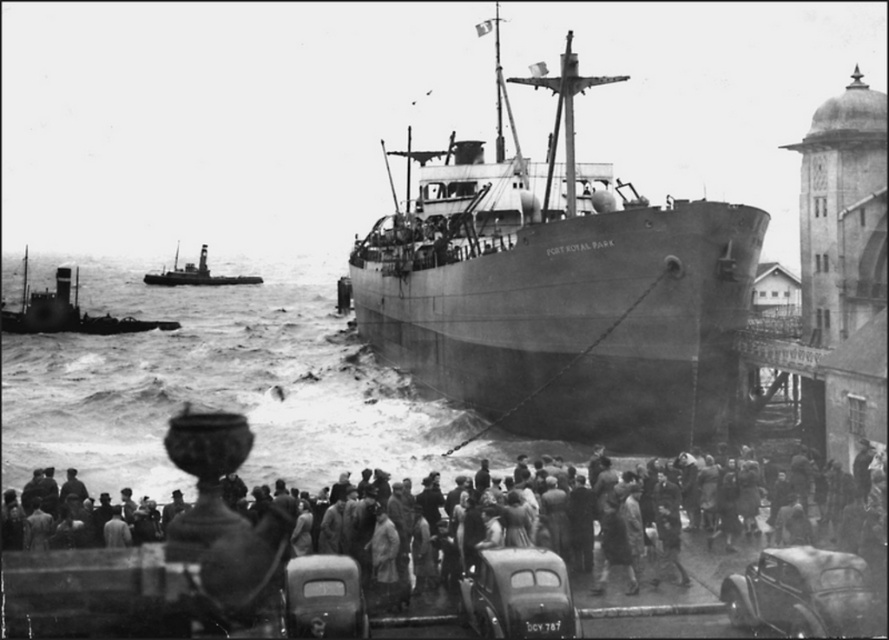
Question: Which object is closer to the camera taking this photo?

Choices:
 (A) rough sea water at lower center
 (B) smooth gray ship at center
 (C) shiny black car at lower right

Answer: (C)

Question: Which object is the closest to the smooth gray ship at center?

Choices:
 (A) rough sea water at lower center
 (B) matte gray car at lower center

Answer: (A)

Question: Does matte gray car at lower center appear over brushed metal tugboat at upper left?

Choices:
 (A) no
 (B) yes

Answer: (A)

Question: Does rough sea water at lower center have a larger size compared to matte gray car at lower center?

Choices:
 (A) yes
 (B) no

Answer: (A)

Question: Can you confirm if rough sea water at lower center is positioned to the left of matte gray car at lower center?

Choices:
 (A) no
 (B) yes

Answer: (B)

Question: Based on their relative distances, which object is farther from the coarse wool coat at lower center?

Choices:
 (A) brushed metal tugboat at left
 (B) matte gray car at lower center
 (C) shiny black car at lower right

Answer: (A)